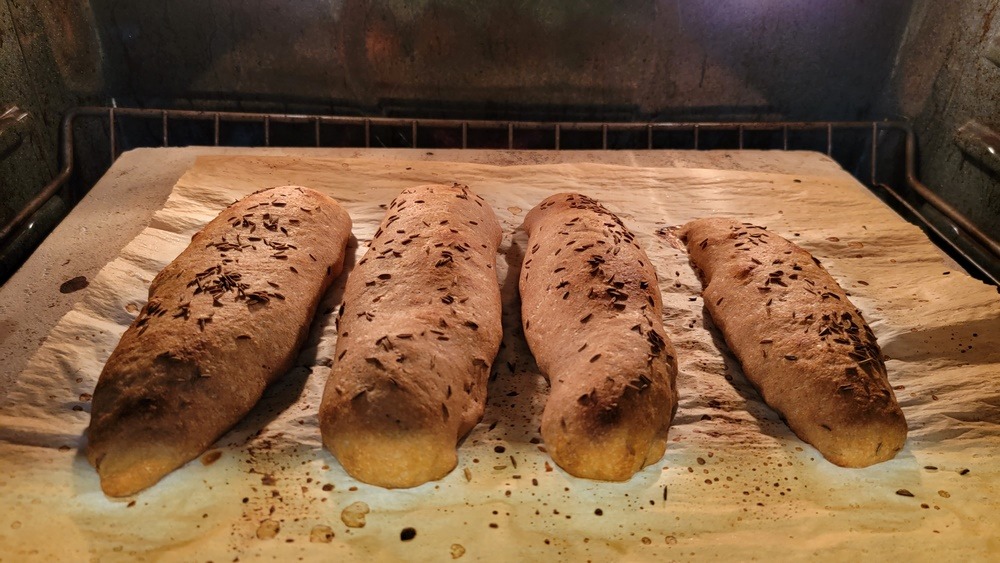
At what (x,y) coordinates should I click in order to perform the action: click on stains. Please return your answer as a coordinate pair (x, y). This screenshot has height=563, width=1000. Looking at the image, I should click on (408, 536), (259, 524), (320, 539), (360, 513), (457, 551).